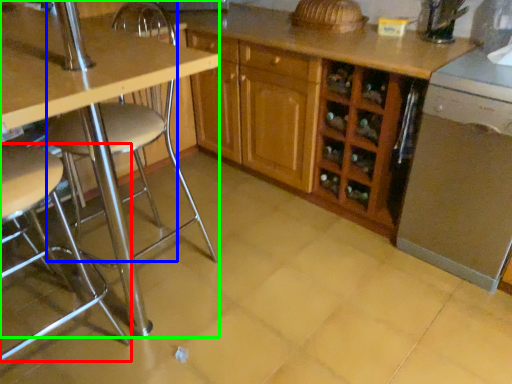
Question: Which is nearer to the chair (highlighted by a red box)? swivel chair (highlighted by a blue box) or table (highlighted by a green box).

Choices:
 (A) swivel chair
 (B) table

Answer: (B)